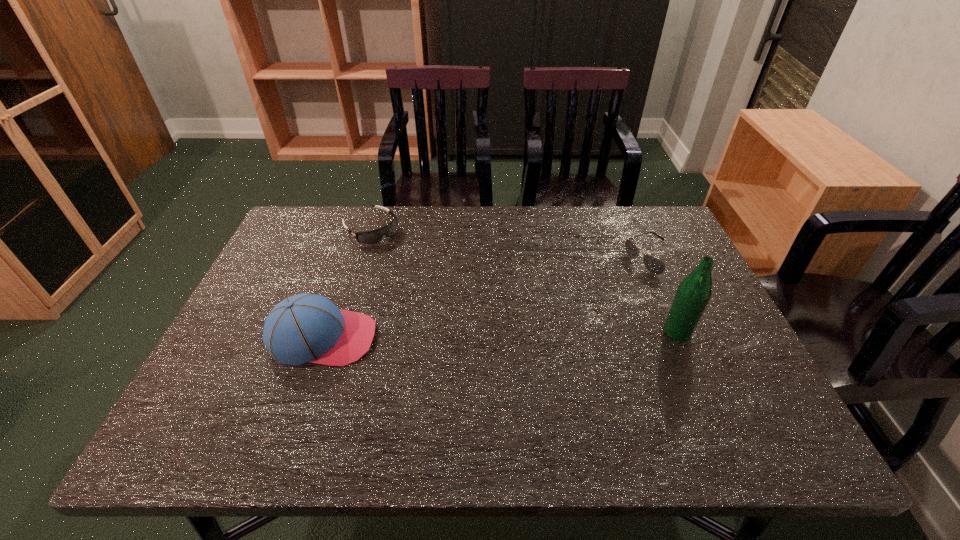
The image size is (960, 540). Identify the location of vacant space located on the front and sides of the goggles. (410, 264).

Find the location of a particular element. The width and height of the screenshot is (960, 540). vacant space located on the front and sides of the goggles is located at coordinates (398, 253).

Locate an element on the screen. This screenshot has width=960, height=540. sunglasses located in the far edge section of the desktop is located at coordinates (655, 266).

Where is `goggles that is at the far edge`? goggles that is at the far edge is located at coordinates (374, 236).

The height and width of the screenshot is (540, 960). What are the coordinates of `object that is at the left edge` in the screenshot? It's located at (302, 328).

Image resolution: width=960 pixels, height=540 pixels. What are the coordinates of `bottle located in the right edge section of the desktop` in the screenshot? It's located at (694, 292).

Locate an element on the screen. This screenshot has width=960, height=540. sunglasses located at the right edge is located at coordinates (655, 266).

I want to click on object that is positioned at the far right corner, so [x=655, y=266].

In the image, there is a desktop. Where is `blank space at the far edge`? blank space at the far edge is located at coordinates (516, 222).

In the image, there is a desktop. At what (x,y) coordinates should I click in order to perform the action: click on vacant space at the near edge. Please return your answer as a coordinate pair (x, y). The image size is (960, 540). Looking at the image, I should click on tap(315, 406).